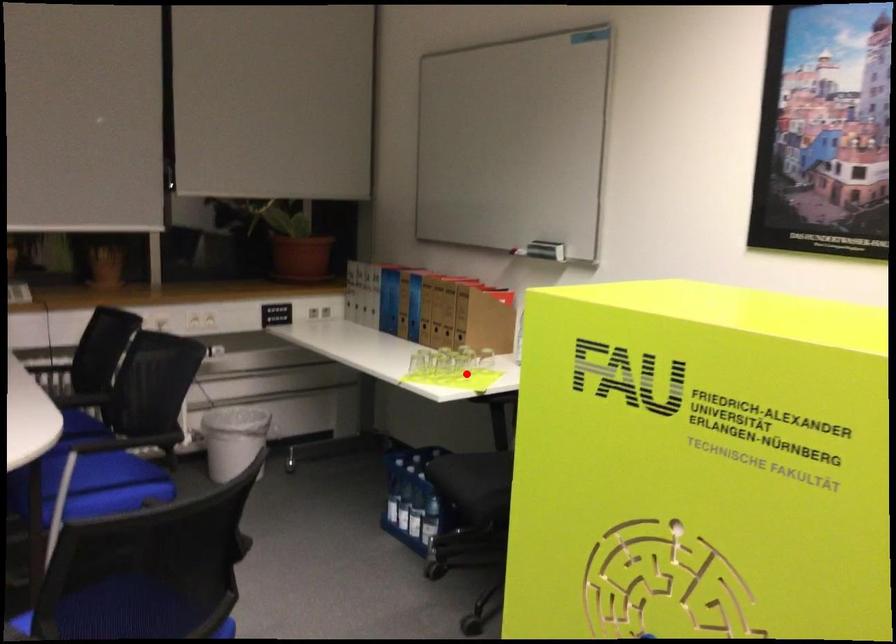
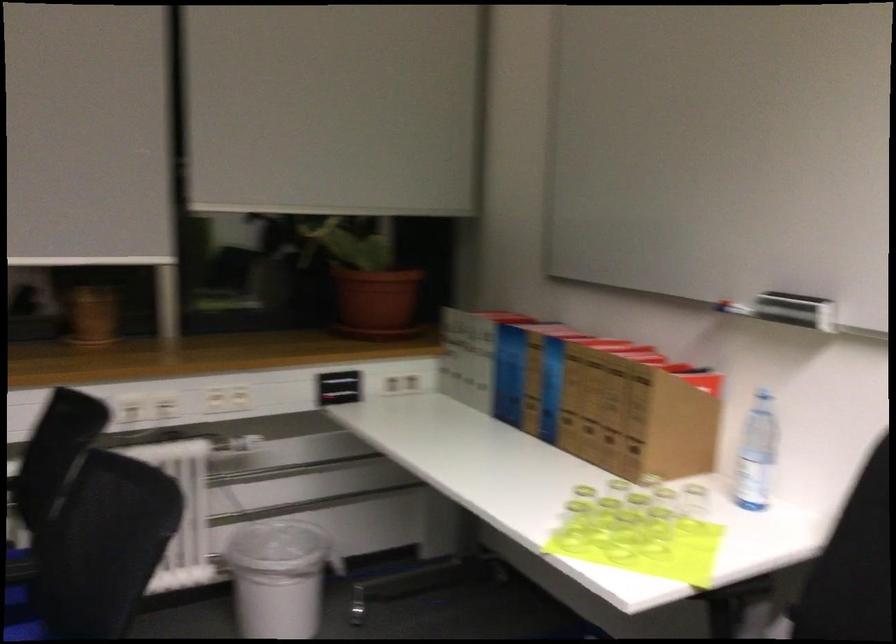
Where in the second image is the point corresponding to the highlighted location from the first image?

(655, 534)